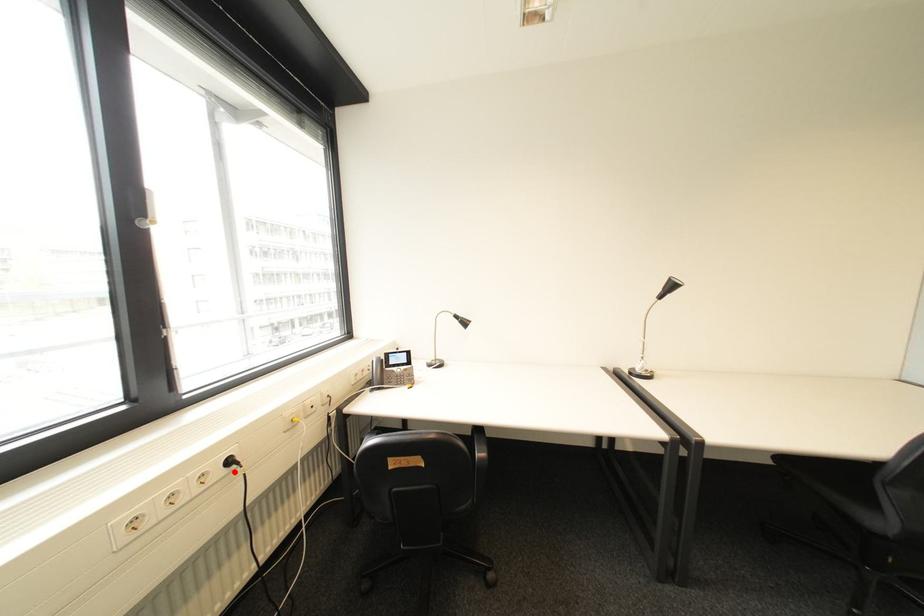
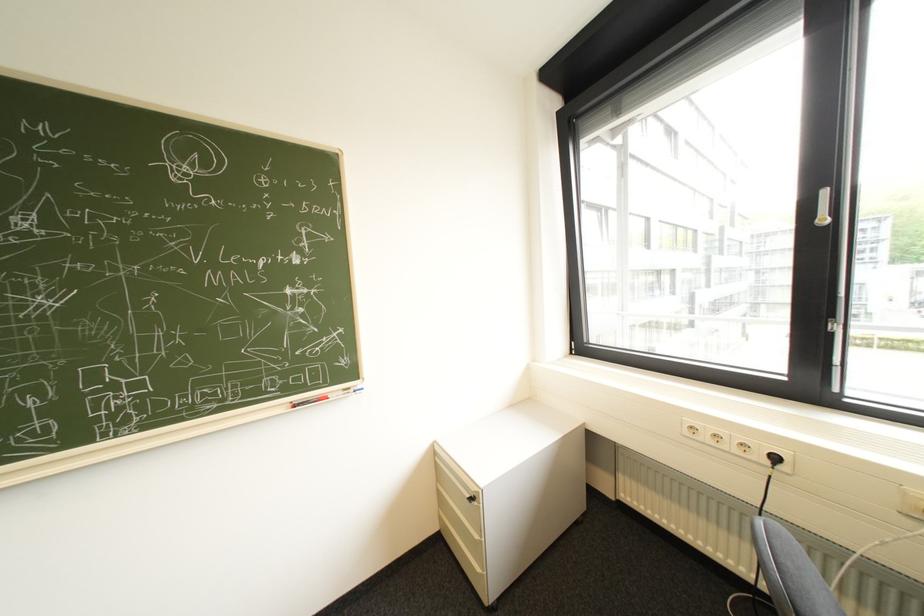
Question: I am providing you with two images of the same scene from different viewpoints. A red point is marked on the first image. At the location where the point appears in image 1, is it still visible in image 2?

Choices:
 (A) Yes
 (B) No

Answer: (A)